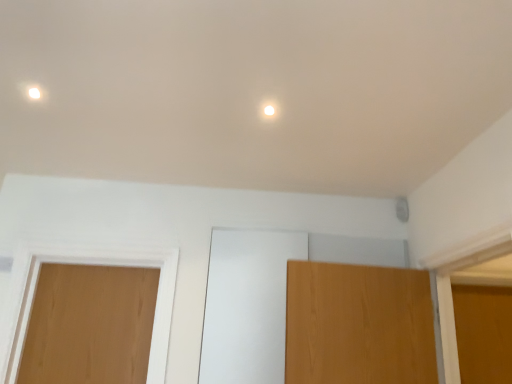
Question: In terms of width, does light brown wood door at left look wider or thinner when compared to white glossy light fixture at upper center?

Choices:
 (A) thin
 (B) wide

Answer: (B)

Question: In the image, is light brown wood door at left on the left side or the right side of white glossy light fixture at upper center?

Choices:
 (A) left
 (B) right

Answer: (A)

Question: From their relative heights in the image, would you say light brown wood door at left is taller or shorter than white glossy light fixture at upper center?

Choices:
 (A) short
 (B) tall

Answer: (B)

Question: Is white glossy light fixture at upper center in front of or behind light brown wood door at left in the image?

Choices:
 (A) front
 (B) behind

Answer: (A)

Question: Visually, is white glossy light fixture at upper center positioned to the left or to the right of light brown wood door at left?

Choices:
 (A) left
 (B) right

Answer: (B)

Question: Considering the positions of point (265, 109) and point (112, 336), is point (265, 109) closer or farther from the camera than point (112, 336)?

Choices:
 (A) closer
 (B) farther

Answer: (A)

Question: Is white glossy light fixture at upper center wider or thinner than light brown wood door at left?

Choices:
 (A) wide
 (B) thin

Answer: (B)